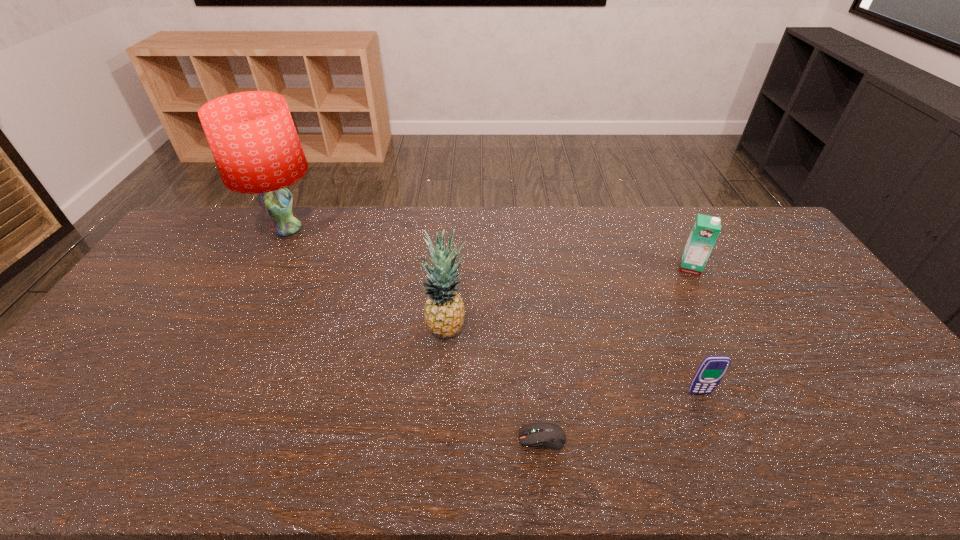
Find the location of `vacant area that lies between the third object from right to left and the lampshade`. vacant area that lies between the third object from right to left and the lampshade is located at coordinates (415, 334).

Find the location of a particular element. This screenshot has width=960, height=540. free space between the rightmost object and the computer equipment is located at coordinates (616, 353).

Where is `free space between the fourth object from right to left and the third object from left to right`? free space between the fourth object from right to left and the third object from left to right is located at coordinates (494, 383).

The height and width of the screenshot is (540, 960). I want to click on vacant point located between the fourth farthest object and the pineapple, so click(573, 361).

The height and width of the screenshot is (540, 960). I want to click on object identified as the fourth closest to the leftmost object, so click(705, 231).

Identify the location of object identified as the fourth closest to the second shortest object. (252, 136).

Identify the location of vacant space that satisfies the following two spatial constraints: 1. on the front-facing side of the tallest object; 2. on the right side of the third tallest object. This screenshot has height=540, width=960. (x=267, y=268).

Identify the location of vacant region that satisfies the following two spatial constraints: 1. on the front-facing side of the cellular telephone; 2. on the button of the shortest object. (717, 438).

This screenshot has width=960, height=540. What are the coordinates of `free spot that satisfies the following two spatial constraints: 1. on the front-facing side of the second farthest object; 2. on the right side of the tallest object` in the screenshot? It's located at (267, 268).

Locate an element on the screen. Image resolution: width=960 pixels, height=540 pixels. vacant space that satisfies the following two spatial constraints: 1. on the front-facing side of the tallest object; 2. on the left side of the fourth object from right to left is located at coordinates (235, 328).